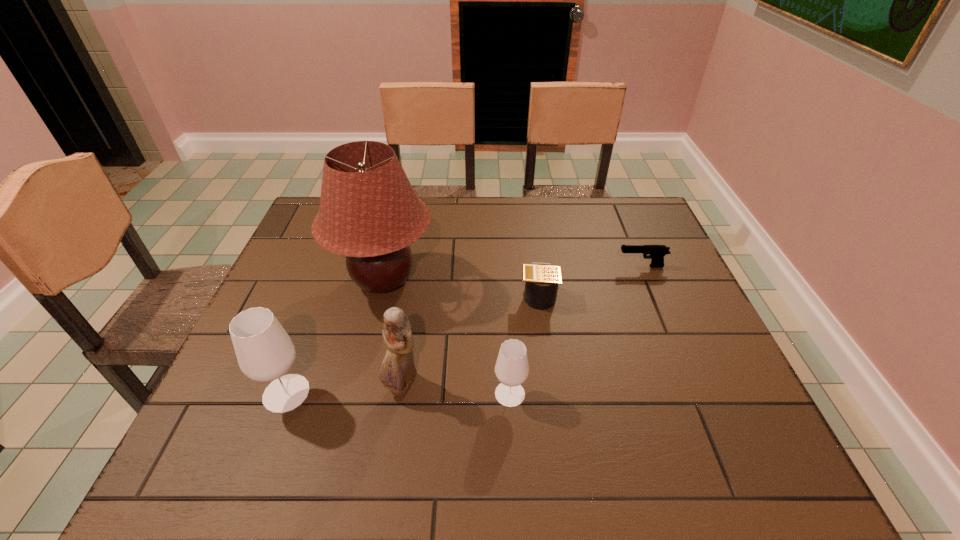
Find the location of a particular element. The height and width of the screenshot is (540, 960). free spot that satisfies the following two spatial constraints: 1. on the front-facing side of the pistol; 2. on the front-facing side of the figurine is located at coordinates (691, 386).

The width and height of the screenshot is (960, 540). What are the coordinates of `vacant space that satisfies the following two spatial constraints: 1. on the front-facing side of the fourth tallest object; 2. on the left side of the figurine` in the screenshot? It's located at (401, 394).